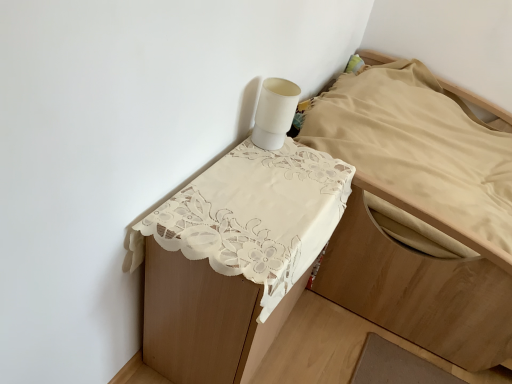
Question: Considering the relative positions of white lace tablecloth at upper center and white lace tablecloth at upper center in the image provided, is white lace tablecloth at upper center to the left of white lace tablecloth at upper center from the viewer's perspective?

Choices:
 (A) no
 (B) yes

Answer: (A)

Question: Is white lace tablecloth at upper center facing away from white lace tablecloth at upper center?

Choices:
 (A) no
 (B) yes

Answer: (A)

Question: Is white lace tablecloth at upper center thinner than white lace tablecloth at upper center?

Choices:
 (A) yes
 (B) no

Answer: (B)

Question: Can you confirm if white lace tablecloth at upper center is positioned to the right of white lace tablecloth at upper center?

Choices:
 (A) no
 (B) yes

Answer: (B)

Question: From a real-world perspective, is white lace tablecloth at upper center positioned over white lace tablecloth at upper center based on gravity?

Choices:
 (A) no
 (B) yes

Answer: (B)

Question: Is white lace tablecloth at upper center in contact with white lace tablecloth at upper center?

Choices:
 (A) no
 (B) yes

Answer: (A)

Question: Is white lace tablecloth at upper center at the back of white lace tablecloth at upper center?

Choices:
 (A) no
 (B) yes

Answer: (A)

Question: From the image's perspective, is white lace tablecloth at upper center on white lace tablecloth at upper center?

Choices:
 (A) yes
 (B) no

Answer: (B)

Question: From a real-world perspective, is white lace tablecloth at upper center physically above white lace tablecloth at upper center?

Choices:
 (A) no
 (B) yes

Answer: (A)

Question: Is the position of white lace tablecloth at upper center more distant than that of white lace tablecloth at upper center?

Choices:
 (A) yes
 (B) no

Answer: (B)

Question: Considering the relative sizes of white lace tablecloth at upper center and white lace tablecloth at upper center in the image provided, is white lace tablecloth at upper center shorter than white lace tablecloth at upper center?

Choices:
 (A) no
 (B) yes

Answer: (A)

Question: Is white lace tablecloth at upper center taller than white lace tablecloth at upper center?

Choices:
 (A) no
 (B) yes

Answer: (B)

Question: Considering the positions of white lace tablecloth at upper center and white lace tablecloth at upper center in the image, is white lace tablecloth at upper center taller or shorter than white lace tablecloth at upper center?

Choices:
 (A) short
 (B) tall

Answer: (B)